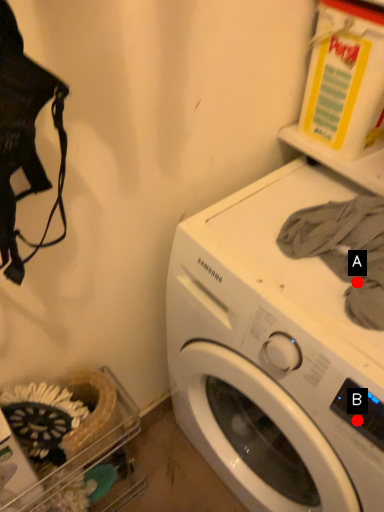
Question: Two points are circled on the image, labeled by A and B beside each circle. Which point is closer to the camera?

Choices:
 (A) A is closer
 (B) B is closer

Answer: (B)